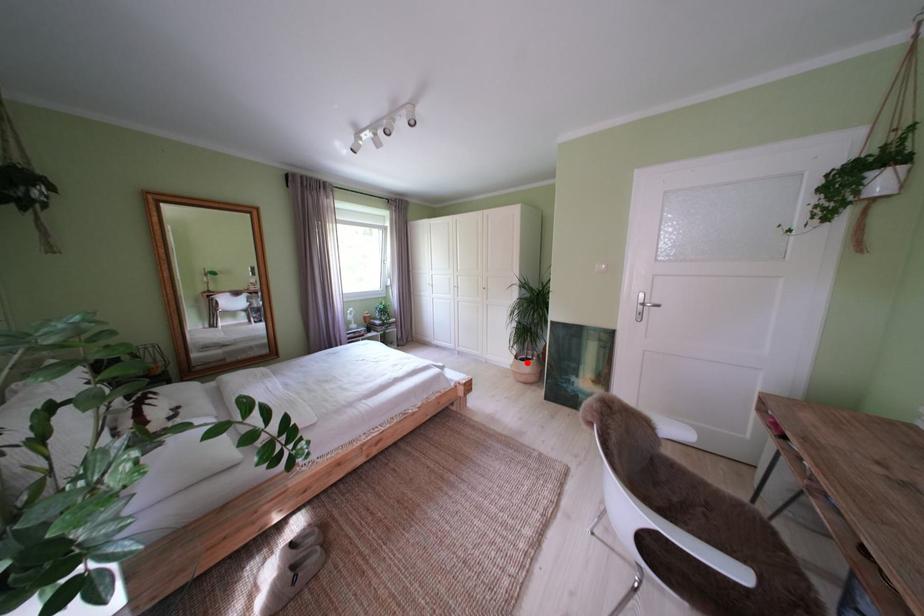
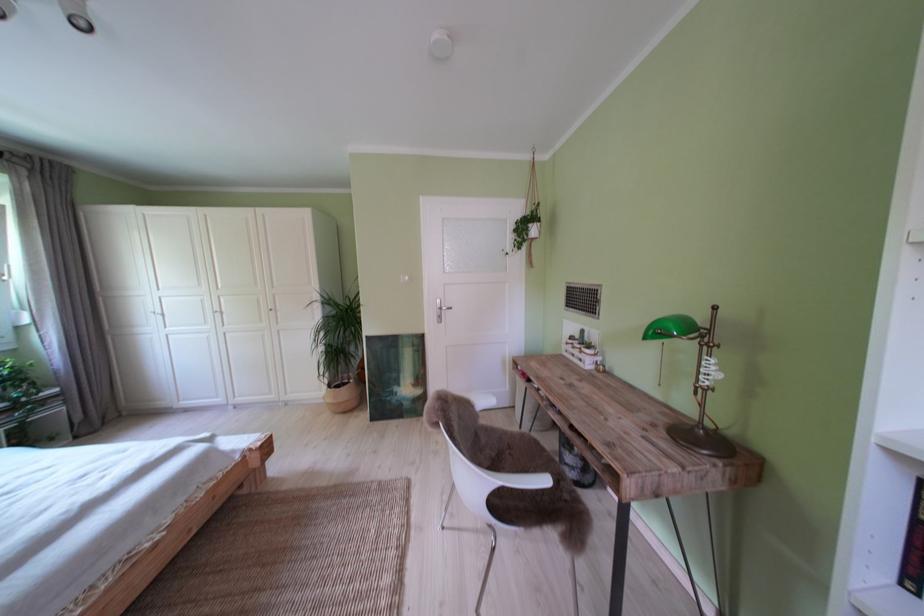
The point at the highlighted location is marked in the first image. Where is the corresponding point in the second image?

(341, 392)